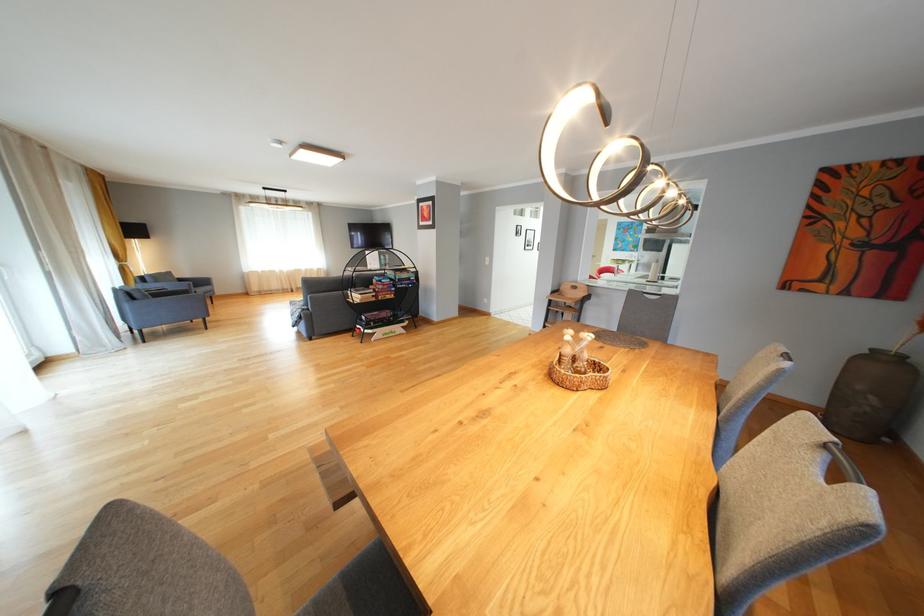
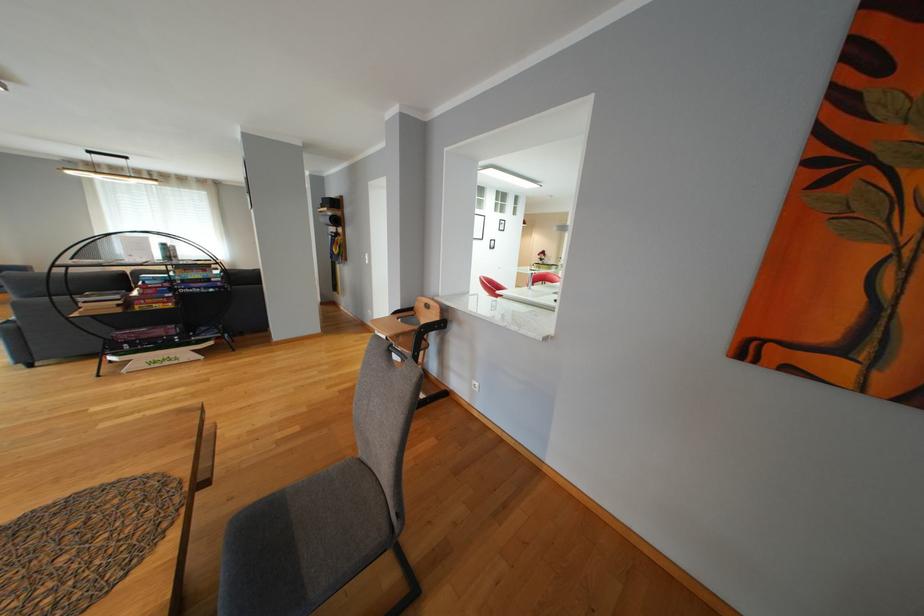
Which direction would the cameraman need to move to produce the second image?

The cameraman walked toward right, forward.